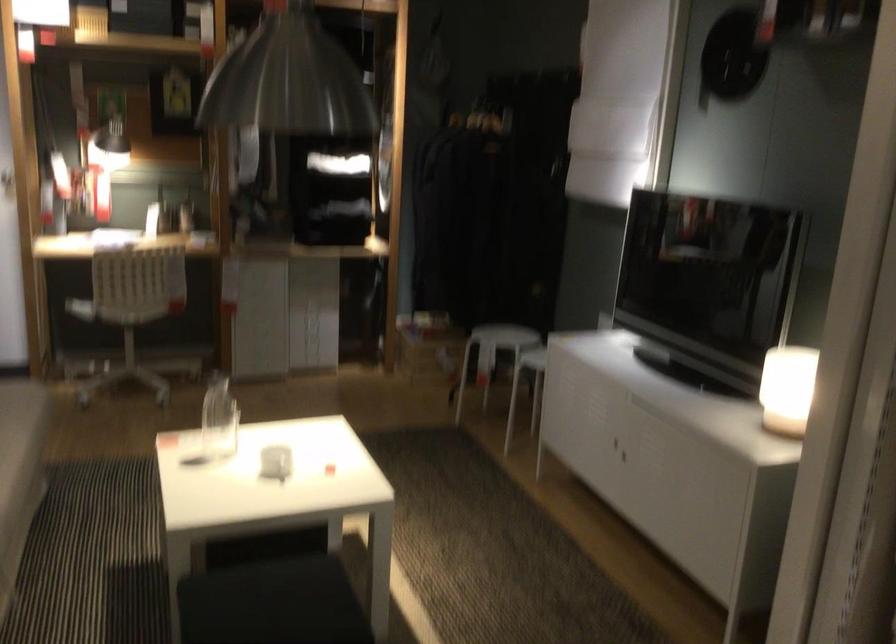
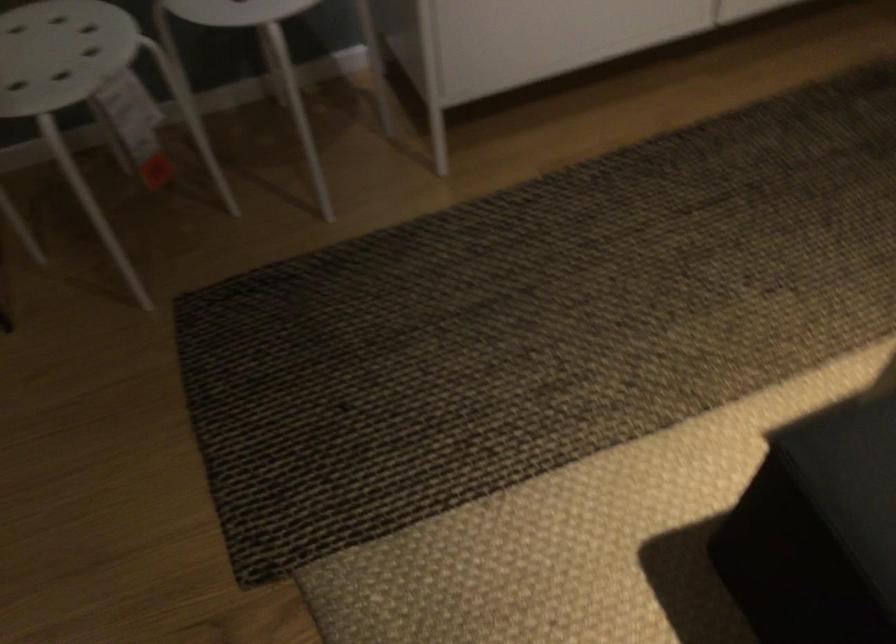
Locate, in the second image, the point that corresponds to point 510,330 in the first image.

(61, 53)